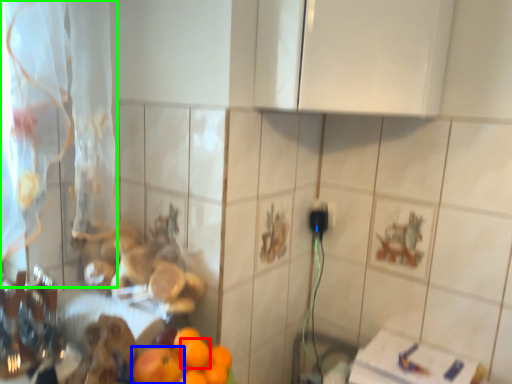
Question: Based on their relative distances, which object is nearer to orange (highlighted by a red box)? Choose from orange (highlighted by a blue box) and curtain (highlighted by a green box).

Choices:
 (A) orange
 (B) curtain

Answer: (A)